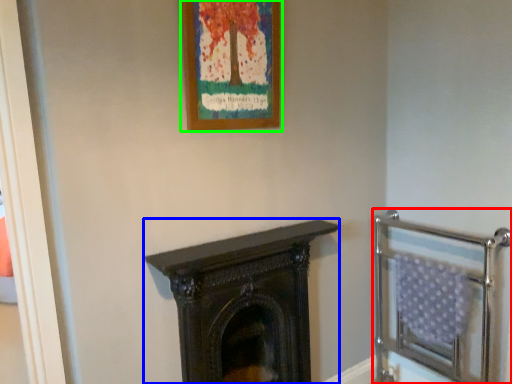
Question: Which object is the closest to the balustrade (highlighted by a red box)? Choose among these: fireplace (highlighted by a blue box) or picture frame (highlighted by a green box).

Choices:
 (A) fireplace
 (B) picture frame

Answer: (A)